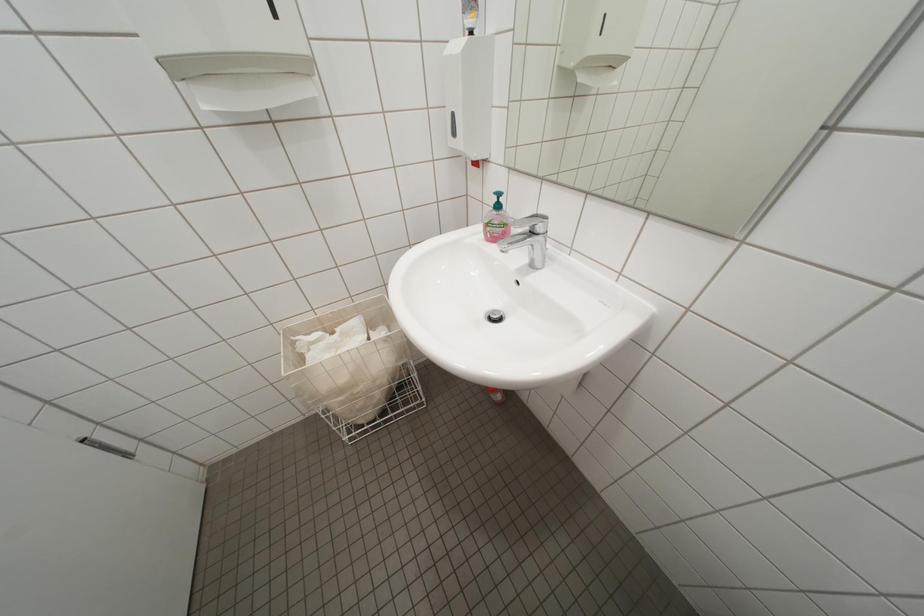
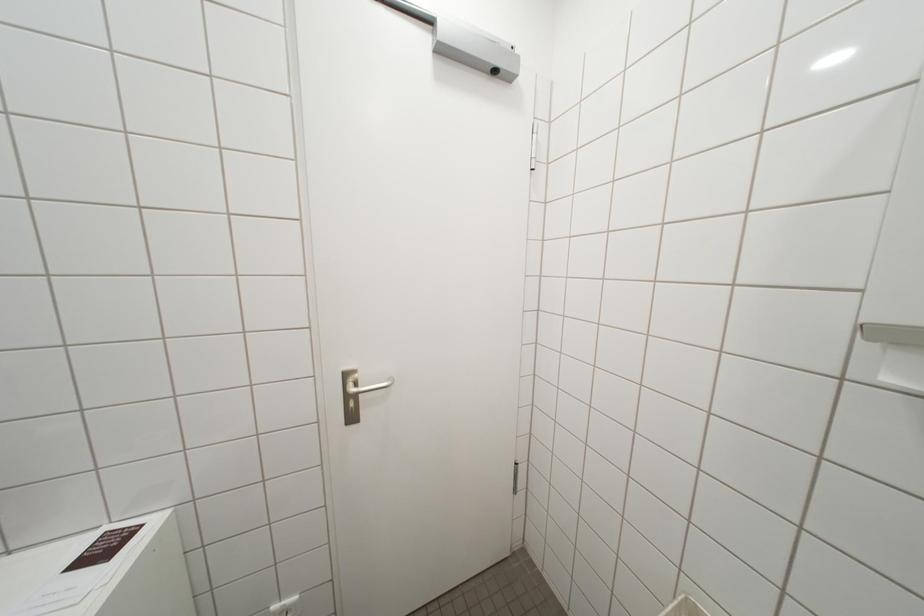
Question: How did the camera likely rotate?

Choices:
 (A) Left
 (B) Right
 (C) Up
 (D) Down

Answer: (A)